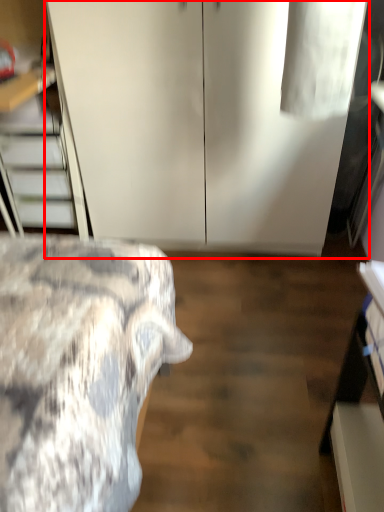
Question: From the image's perspective, considering the relative positions of dresser (annotated by the red box) and stairwell in the image provided, where is dresser (annotated by the red box) located with respect to the staircase?

Choices:
 (A) below
 (B) above

Answer: (B)